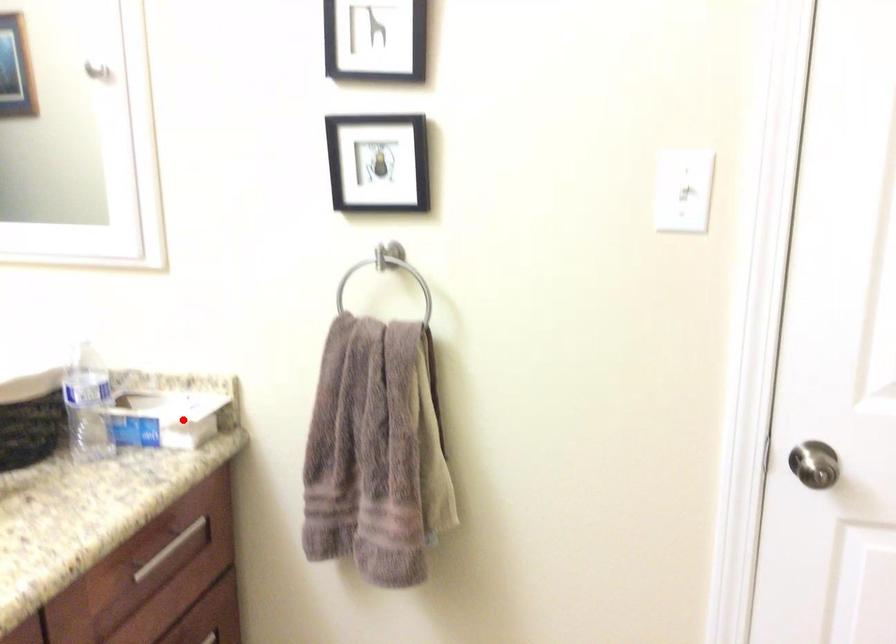
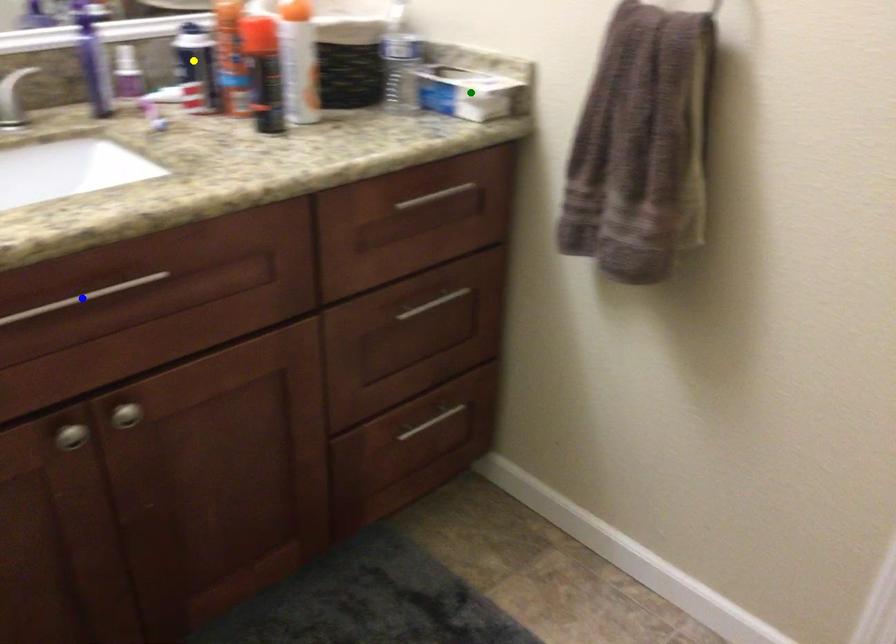
Question: I am providing you with two images of the same scene from different viewpoints. A red point is marked on the first image. You are given multiple points on the second image. Which point in image 2 represents the same 3d spot as the red point in image 1?

Choices:
 (A) green point
 (B) blue point
 (C) yellow point

Answer: (A)